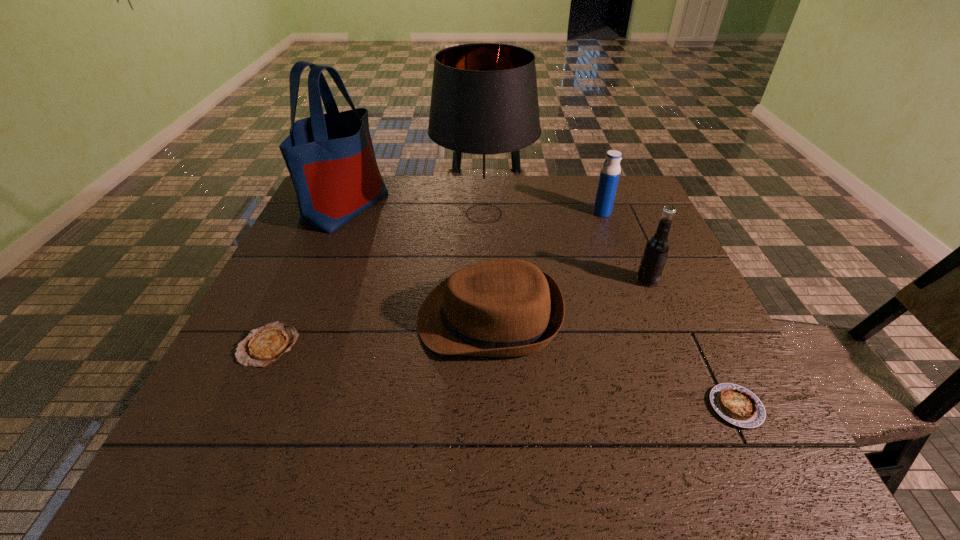
Locate an element on the screen. The image size is (960, 540). vacant space situated on the right of the handbag is located at coordinates 408,207.

Where is `vacant area situated 0.360m on the label of the root beer`? Image resolution: width=960 pixels, height=540 pixels. vacant area situated 0.360m on the label of the root beer is located at coordinates (492, 281).

Locate an element on the screen. This screenshot has width=960, height=540. vacant space located 0.050m on the label of the root beer is located at coordinates (616, 281).

At what (x,y) coordinates should I click in order to perform the action: click on free space located 0.070m on the label of the root beer. Please return your answer as a coordinate pair (x, y). Looking at the image, I should click on (608, 281).

Identify the location of vacant area situated on the right of the water bottle. (628, 213).

Find the location of `vacant region located on the front-facing side of the third shortest object`. vacant region located on the front-facing side of the third shortest object is located at coordinates (347, 319).

Locate an element on the screen. The image size is (960, 540). vacant space located on the front-facing side of the third shortest object is located at coordinates (347, 319).

Where is `blank space located on the front-facing side of the third shortest object`? This screenshot has height=540, width=960. blank space located on the front-facing side of the third shortest object is located at coordinates (391, 319).

Find the location of a particular element. vacant region located on the back of the right quiche is located at coordinates coord(690,315).

Locate an element on the screen. The image size is (960, 540). free space located 0.310m on the right of the shorter quiche is located at coordinates (442, 345).